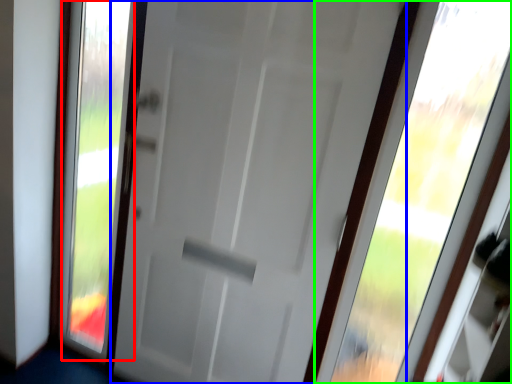
Question: Estimate the real-world distances between objects in this image. Which object is farther from glass window (highlighted by a red box), door (highlighted by a blue box) or window (highlighted by a green box)?

Choices:
 (A) door
 (B) window

Answer: (B)